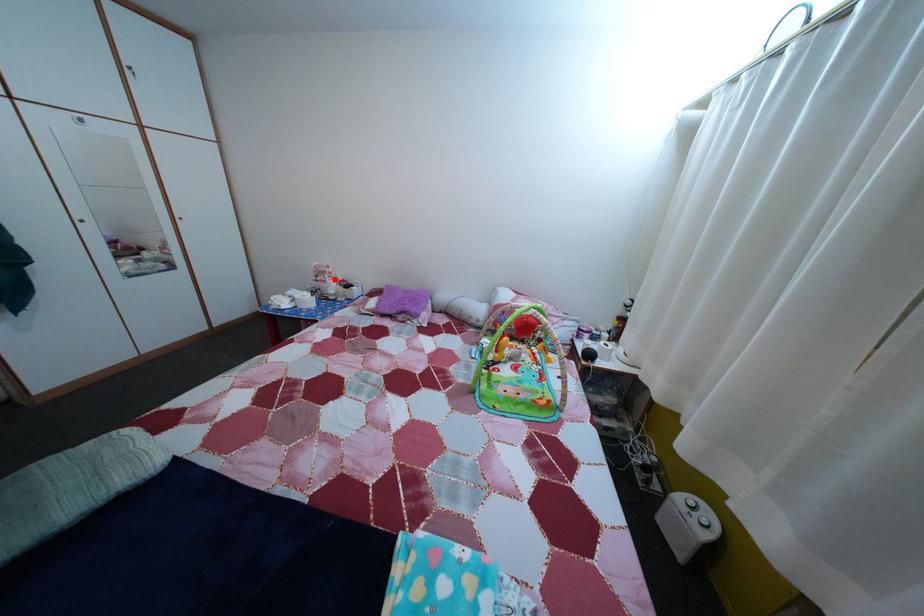
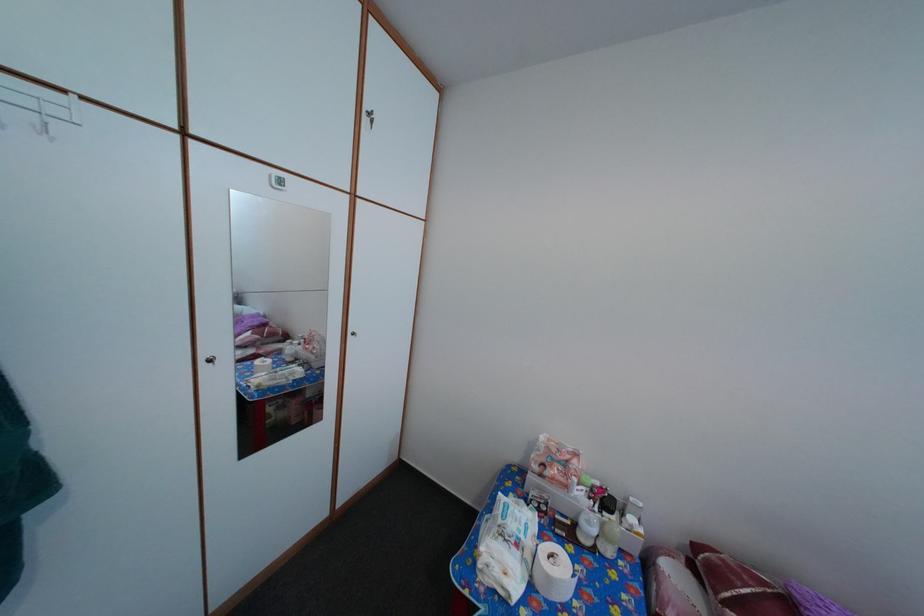
Question: I am providing you with two images of the same scene from different viewpoints. In image1, a red point is highlighted. Considering the same 3D point in image2, which of the following is correct?

Choices:
 (A) It is closer
 (B) It is farther

Answer: (B)